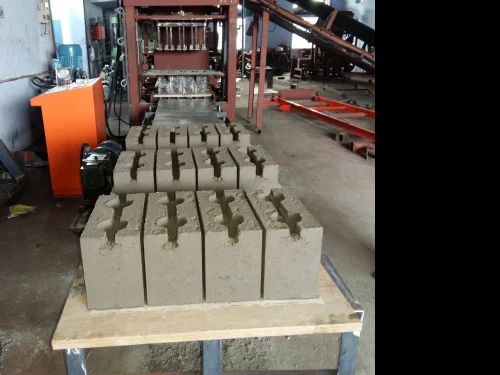
Locate an element on the screen. The height and width of the screenshot is (375, 500). floor is located at coordinates (334, 207), (30, 277).